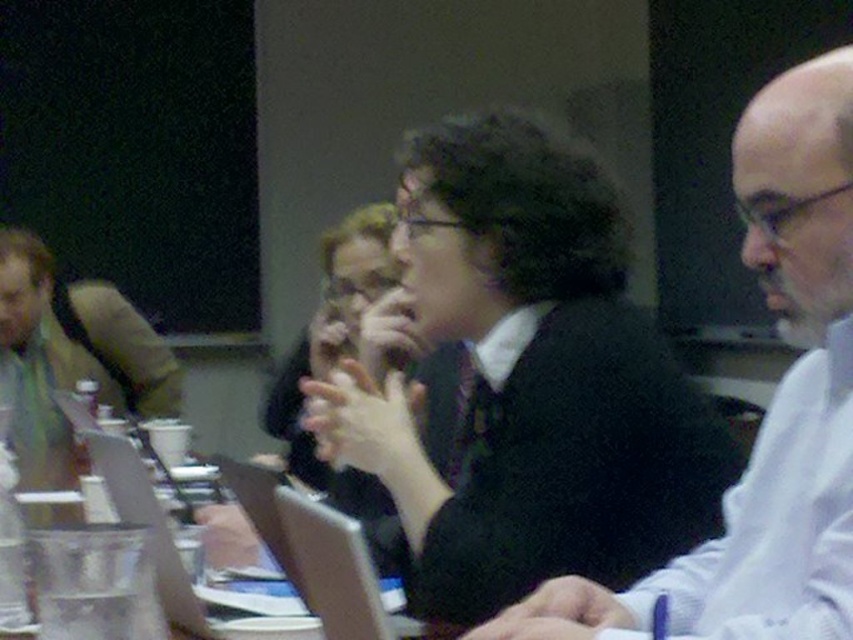
Question: Is black matte suit at center closer to the viewer compared to black sweater at center?

Choices:
 (A) no
 (B) yes

Answer: (A)

Question: Which point is closer to the camera taking this photo?

Choices:
 (A) (631, 509)
 (B) (798, 129)

Answer: (B)

Question: Which point is farther to the camera?

Choices:
 (A) (561, 492)
 (B) (819, 492)

Answer: (A)

Question: Is black matte suit at center below black sweater at center?

Choices:
 (A) yes
 (B) no

Answer: (B)

Question: Can you confirm if black matte suit at center is positioned to the right of black sweater at center?

Choices:
 (A) no
 (B) yes

Answer: (A)